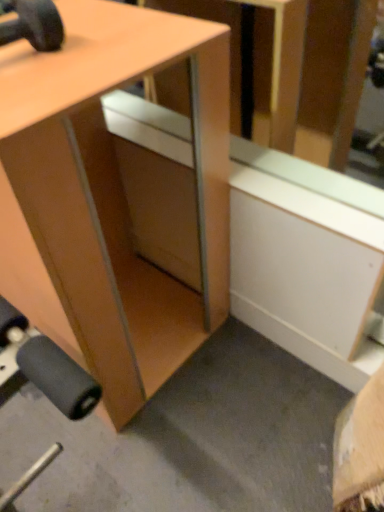
Question: Considering the relative positions of matte wood desk at center and matte black dumbbell at upper left in the image provided, is matte wood desk at center to the left or to the right of matte black dumbbell at upper left?

Choices:
 (A) right
 (B) left

Answer: (A)

Question: Considering the positions of point (x=3, y=285) and point (x=21, y=12), is point (x=3, y=285) closer or farther from the camera than point (x=21, y=12)?

Choices:
 (A) farther
 (B) closer

Answer: (A)

Question: Considering their positions, is matte wood desk at center located in front of or behind matte black dumbbell at upper left?

Choices:
 (A) front
 (B) behind

Answer: (A)

Question: From the image's perspective, is matte black dumbbell at upper left above or below matte wood desk at center?

Choices:
 (A) below
 (B) above

Answer: (B)

Question: In the image, is matte black dumbbell at upper left positioned in front of or behind matte wood desk at center?

Choices:
 (A) front
 (B) behind

Answer: (B)

Question: Is matte black dumbbell at upper left bigger or smaller than matte wood desk at center?

Choices:
 (A) big
 (B) small

Answer: (B)

Question: From a real-world perspective, relative to matte wood desk at center, is matte black dumbbell at upper left vertically above or below?

Choices:
 (A) below
 (B) above

Answer: (B)